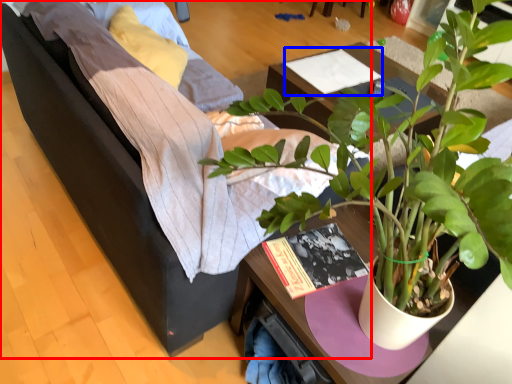
Question: Which object appears closest to the camera in this image, studio couch (highlighted by a red box) or magazine (highlighted by a blue box)?

Choices:
 (A) studio couch
 (B) magazine

Answer: (A)